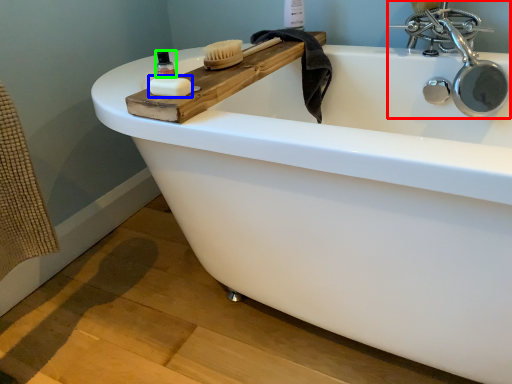
Question: Based on their relative distances, which object is farther from tap (highlighted by a red box)? Choose from soap (highlighted by a blue box) and mouthwash (highlighted by a green box).

Choices:
 (A) soap
 (B) mouthwash

Answer: (A)